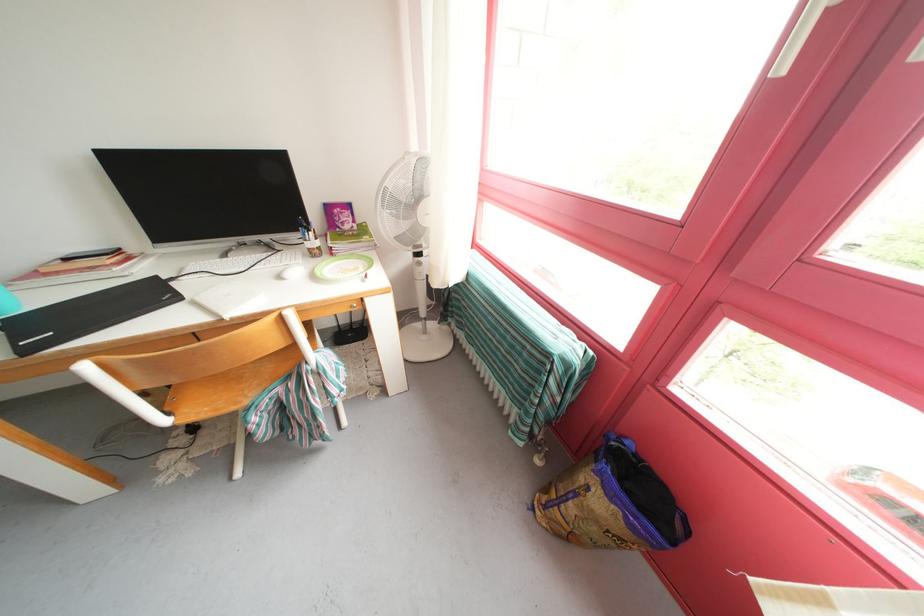
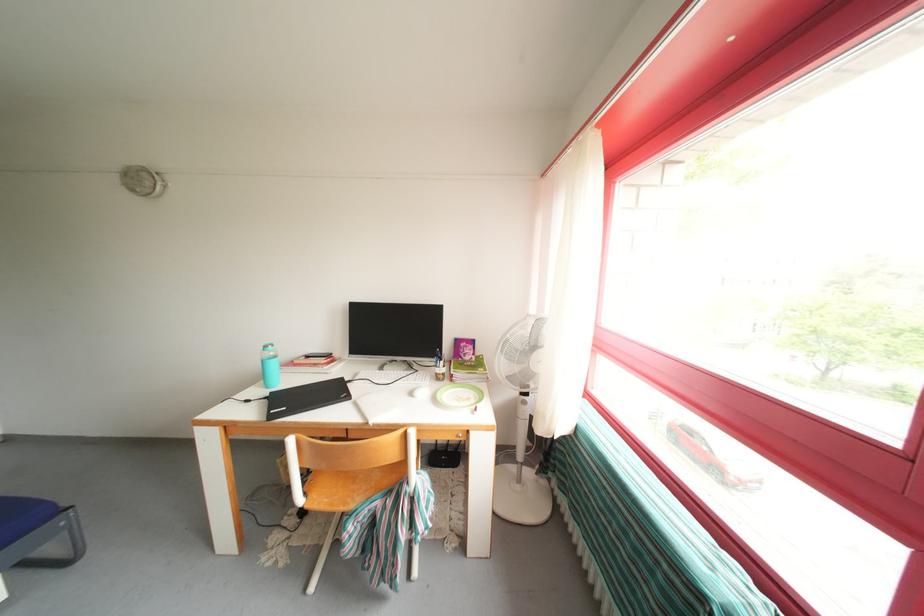
How did the camera likely rotate?

The camera rotated toward left-up.